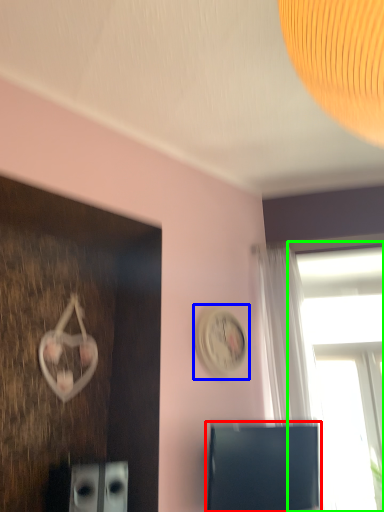
Question: Based on their relative distances, which object is farther from computer monitor (highlighted by a red box)? Choose from clock (highlighted by a blue box) and window (highlighted by a green box).

Choices:
 (A) clock
 (B) window

Answer: (B)